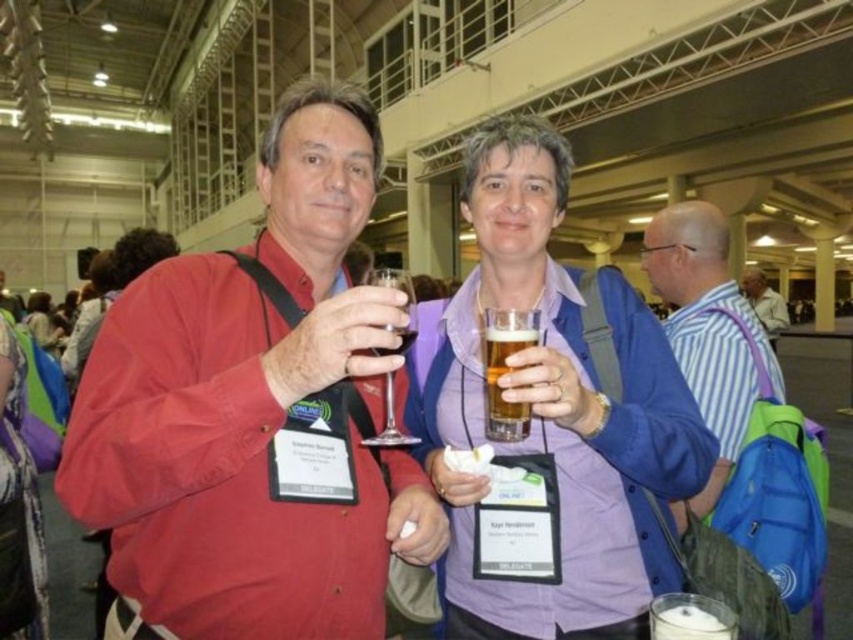
Based on the photo, can you confirm if matte red shirt at center is bigger than purple fabric shirt at center?

No, matte red shirt at center is not bigger than purple fabric shirt at center.

Which of these two, matte red shirt at center or purple fabric shirt at center, stands taller?

purple fabric shirt at center

Which is behind, point (306, 138) or point (524, 204)?

The point (524, 204) is behind.

You are a GUI agent. You are given a task and a screenshot of the screen. Output one action in this format:
    pyautogui.click(x=<x>, y=<y>)
    Task: Click on the matte red shirt at center
    
    Given the screenshot: What is the action you would take?
    pyautogui.click(x=254, y=412)

In the scene shown: Who is positioned more to the right, blue striped shirt at right or golden amber liquid at center?

From the viewer's perspective, blue striped shirt at right appears more on the right side.

Does point (703, 273) come in front of point (489, 346)?

No, it is not.

The height and width of the screenshot is (640, 853). Identify the location of blue striped shirt at right. click(706, 330).

Who is more distant from viewer, (485, 388) or (759, 284)?

The point (759, 284) is more distant.

Can you confirm if golden amber liquid at center is thinner than striped cotton shirt at center?

Correct, golden amber liquid at center's width is less than striped cotton shirt at center's.

This screenshot has height=640, width=853. I want to click on golden amber liquid at center, so click(x=503, y=372).

Image resolution: width=853 pixels, height=640 pixels. Identify the location of golden amber liquid at center. (503, 372).